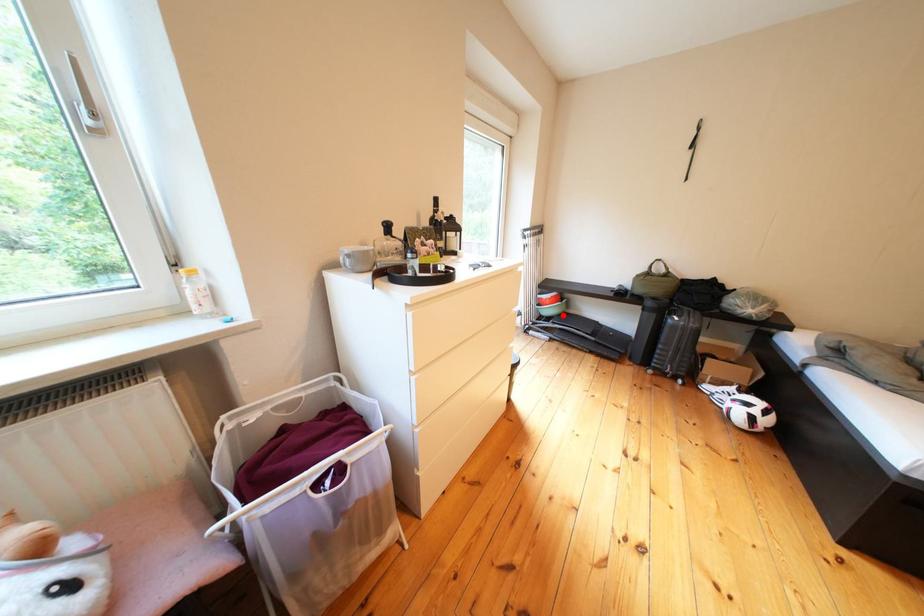
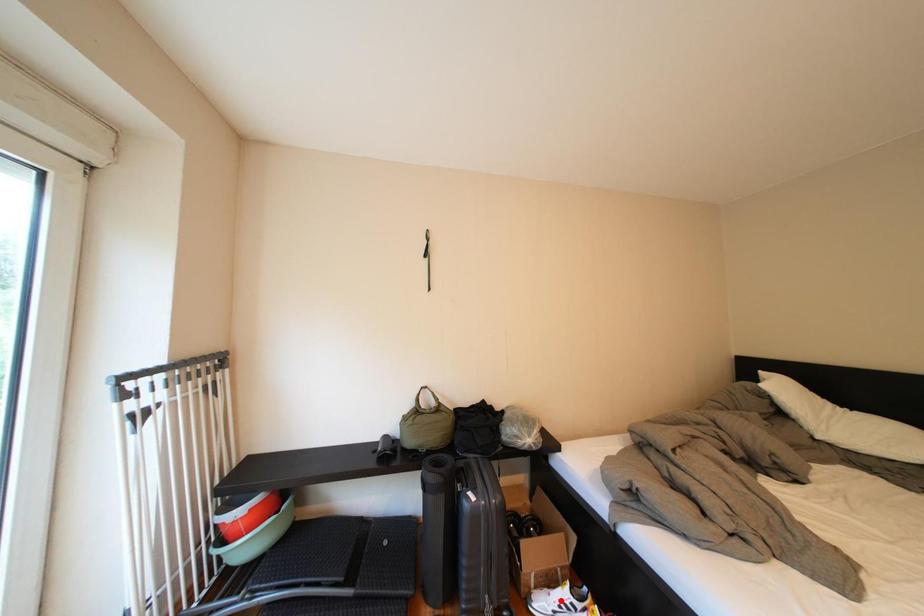
I am providing you with two images of the same scene from different viewpoints. A red point is marked on the first image and another point is marked on the second image. Is the marked point in image1 the same physical position as the marked point in image2?

No